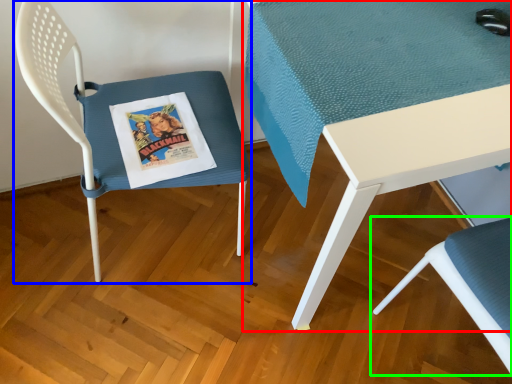
Question: Based on their relative distances, which object is farther from table (highlighted by a red box)? Choose from chair (highlighted by a blue box) and chair (highlighted by a green box).

Choices:
 (A) chair
 (B) chair

Answer: (B)